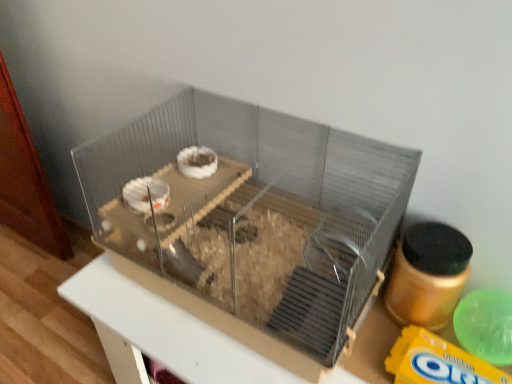
Find the location of a particular element. This screenshot has width=512, height=384. clear plastic cage at center is located at coordinates (252, 217).

What do you see at coordinates (164, 329) in the screenshot? I see `metallic gray cage at center` at bounding box center [164, 329].

In order to face yellow matte cereal at lower right, should I rotate leftwards or rightwards?

A 26.428 degree turn to the right will do.

Image resolution: width=512 pixels, height=384 pixels. In order to click on clear plastic cage at center in this screenshot , I will do `click(252, 217)`.

Is metallic gray cage at center smaller than yellow matte cereal at lower right?

Incorrect, metallic gray cage at center is not smaller in size than yellow matte cereal at lower right.

At what (x,y) coordinates should I click in order to perform the action: click on table on the left side of yellow matte cereal at lower right. Please return your answer as a coordinate pair (x, y). The image size is (512, 384). Looking at the image, I should click on (164, 329).

From the image's perspective, is metallic gray cage at center beneath yellow matte cereal at lower right?

Yes.

Where is `table below the clear plastic cage at center (from the image's perspective)`? The width and height of the screenshot is (512, 384). table below the clear plastic cage at center (from the image's perspective) is located at coordinates (164, 329).

Between metallic gray cage at center and clear plastic cage at center, which one has more height?

metallic gray cage at center is taller.

Would you say metallic gray cage at center is a long distance from clear plastic cage at center?

No, metallic gray cage at center is not far away from clear plastic cage at center.

Which is more to the right, metallic gray cage at center or clear plastic cage at center?

metallic gray cage at center is more to the right.

Is metallic gray cage at center surrounded by clear plastic cage at center?

No, metallic gray cage at center is not surrounded by clear plastic cage at center.

Considering the sizes of objects clear plastic cage at center and metallic gray cage at center in the image provided, who is taller, clear plastic cage at center or metallic gray cage at center?

metallic gray cage at center.

Is clear plastic cage at center oriented towards metallic gray cage at center?

No, clear plastic cage at center is not aimed at metallic gray cage at center.

From a real-world perspective, is clear plastic cage at center physically located above or below metallic gray cage at center?

clear plastic cage at center is above metallic gray cage at center.

From a real-world perspective, is clear plastic cage at center beneath yellow matte cereal at lower right?

No, from a real-world perspective, clear plastic cage at center is not beneath yellow matte cereal at lower right.

Between clear plastic cage at center and yellow matte cereal at lower right, which one is positioned in front?

clear plastic cage at center is more forward.

How many degrees apart are the facing directions of clear plastic cage at center and yellow matte cereal at lower right?

The angle between the facing direction of clear plastic cage at center and the facing direction of yellow matte cereal at lower right is 2.48e-05 degrees.

From the image's perspective, is clear plastic cage at center above or below yellow matte cereal at lower right?

Based on their image positions, clear plastic cage at center is located above yellow matte cereal at lower right.

In terms of width, does yellow matte cereal at lower right look wider or thinner when compared to metallic gray cage at center?

Clearly, yellow matte cereal at lower right has less width compared to metallic gray cage at center.

Is metallic gray cage at center at the back of yellow matte cereal at lower right?

No, yellow matte cereal at lower right is not facing the opposite direction of metallic gray cage at center.

In terms of size, does yellow matte cereal at lower right appear bigger or smaller than metallic gray cage at center?

In the image, yellow matte cereal at lower right appears to be smaller than metallic gray cage at center.

Identify the location of table located below the yellow matte cereal at lower right (from the image's perspective). Image resolution: width=512 pixels, height=384 pixels. (164, 329).

Considering the sizes of objects yellow matte cereal at lower right and clear plastic cage at center in the image provided, who is taller, yellow matte cereal at lower right or clear plastic cage at center?

clear plastic cage at center.

Is yellow matte cereal at lower right wider or thinner than clear plastic cage at center?

In the image, yellow matte cereal at lower right appears to be more narrow than clear plastic cage at center.

From a real-world perspective, is yellow matte cereal at lower right under clear plastic cage at center?

Yes.

This screenshot has height=384, width=512. I want to click on glass box positioned vertically above the yellow matte cereal at lower right (from a real-world perspective), so click(x=252, y=217).

The width and height of the screenshot is (512, 384). I want to click on cereal on the right of metallic gray cage at center, so click(x=437, y=361).

This screenshot has width=512, height=384. Identify the location of table behind the clear plastic cage at center. (164, 329).

Estimate the real-world distances between objects in this image. Which object is closer to clear plastic cage at center, yellow matte cereal at lower right or metallic gray cage at center?

metallic gray cage at center.

Considering their positions, is metallic gray cage at center positioned further to yellow matte cereal at lower right than clear plastic cage at center?

clear plastic cage at center lies further to yellow matte cereal at lower right than the other object.

Considering their positions, is yellow matte cereal at lower right positioned further to metallic gray cage at center than clear plastic cage at center?

yellow matte cereal at lower right lies further to metallic gray cage at center than the other object.

Considering their positions, is clear plastic cage at center positioned closer to metallic gray cage at center than yellow matte cereal at lower right?

clear plastic cage at center.

From the image, which object appears to be nearer to clear plastic cage at center, metallic gray cage at center or yellow matte cereal at lower right?

metallic gray cage at center lies closer to clear plastic cage at center than the other object.

Looking at the image, which one is located closer to yellow matte cereal at lower right, clear plastic cage at center or metallic gray cage at center?

Among the two, metallic gray cage at center is located nearer to yellow matte cereal at lower right.

Where is `table between clear plastic cage at center and yellow matte cereal at lower right`? The image size is (512, 384). table between clear plastic cage at center and yellow matte cereal at lower right is located at coordinates (164, 329).